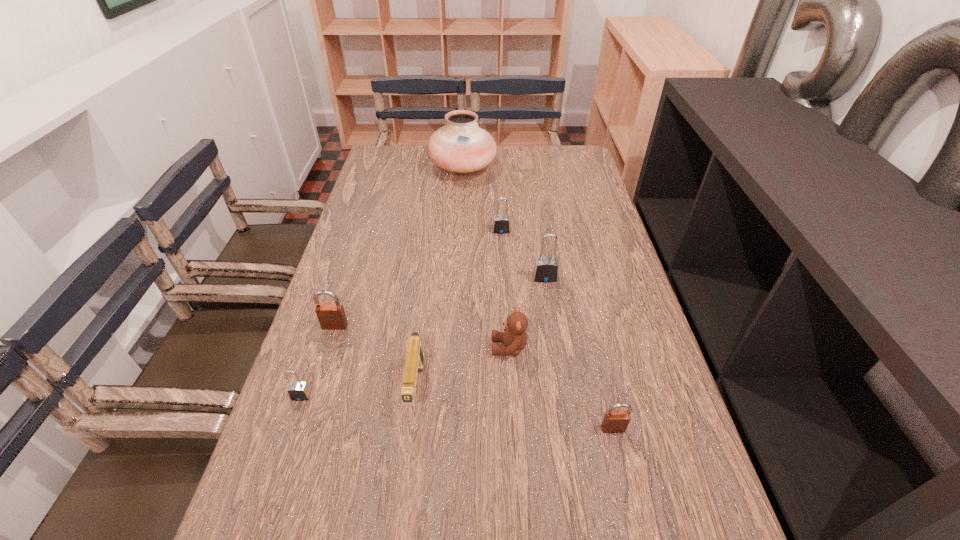
Identify the location of the smallest gray padlock. (298, 391).

Where is `the nearest gray padlock`? the nearest gray padlock is located at coordinates point(298,391).

Where is `the nearest padlock`? The height and width of the screenshot is (540, 960). the nearest padlock is located at coordinates (615, 421).

I want to click on the right brown padlock, so click(x=615, y=421).

Locate an element on the screen. The height and width of the screenshot is (540, 960). vacant region located 0.180m on the front of the pottery is located at coordinates (460, 214).

The height and width of the screenshot is (540, 960). Identify the location of free space located on the shackle of the fourth padlock from left to right. (566, 414).

Identify the location of vacant space located on the shackle of the farthest gray padlock. The height and width of the screenshot is (540, 960). (504, 279).

This screenshot has width=960, height=540. I want to click on free space located 0.220m on the front-facing side of the fifth nearest object, so click(308, 412).

Where is `vacant space located on the face of the teddy bear`? This screenshot has width=960, height=540. vacant space located on the face of the teddy bear is located at coordinates (440, 347).

Where is `free space located 0.140m on the face of the teddy bear`? Image resolution: width=960 pixels, height=540 pixels. free space located 0.140m on the face of the teddy bear is located at coordinates (431, 347).